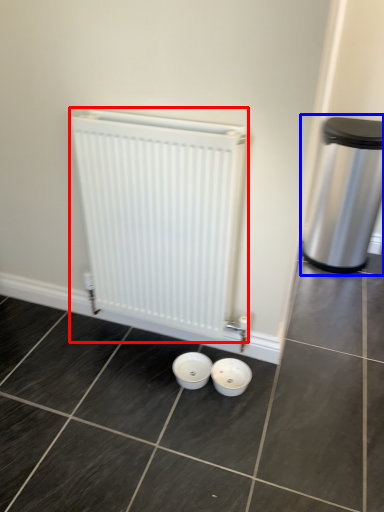
Question: Which point is further to the camera, radiator (highlighted by a red box) or waste container (highlighted by a blue box)?

Choices:
 (A) radiator
 (B) waste container

Answer: (B)